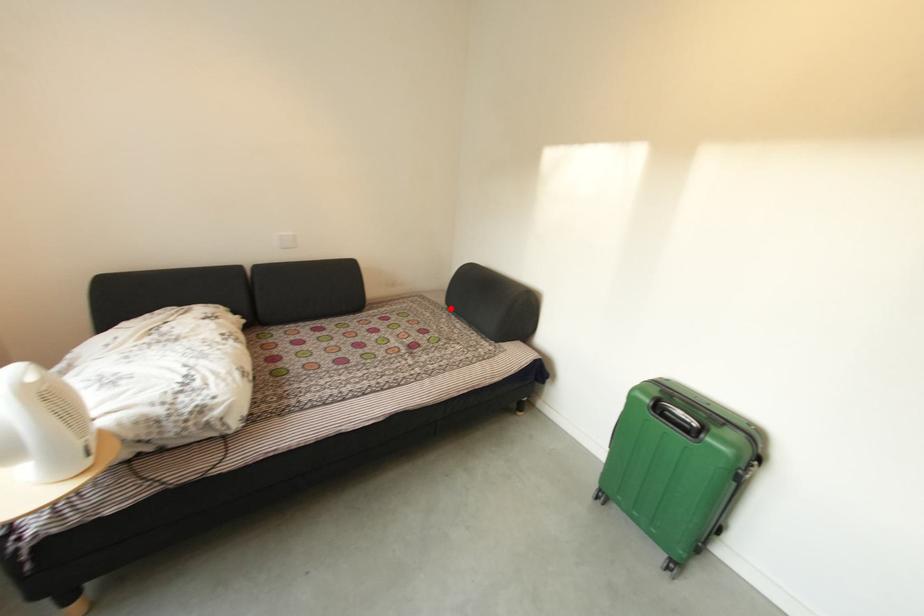
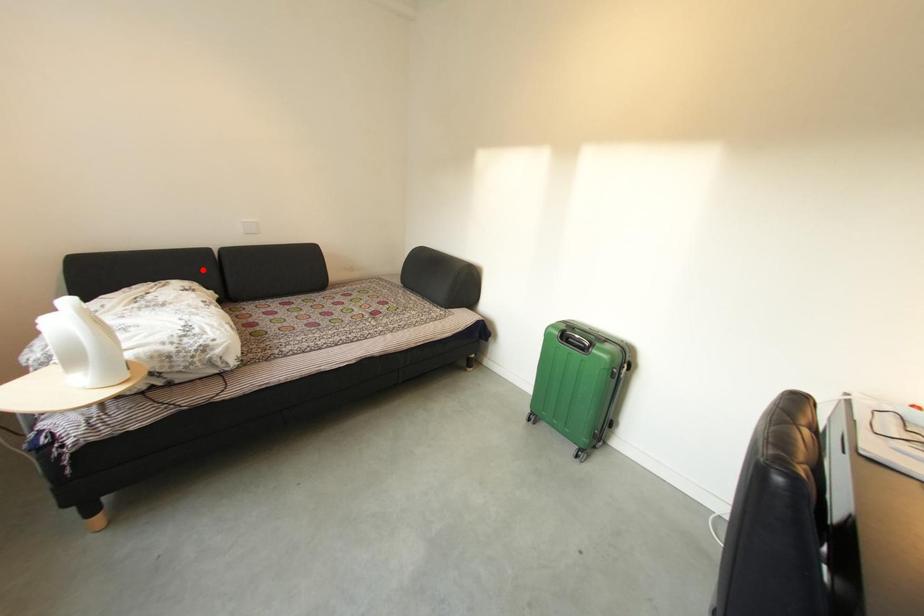
I am providing you with two images of the same scene from different viewpoints. A red point is marked on the first image and another point is marked on the second image. Are the points marked in image1 and image2 representing the same 3D position?

No